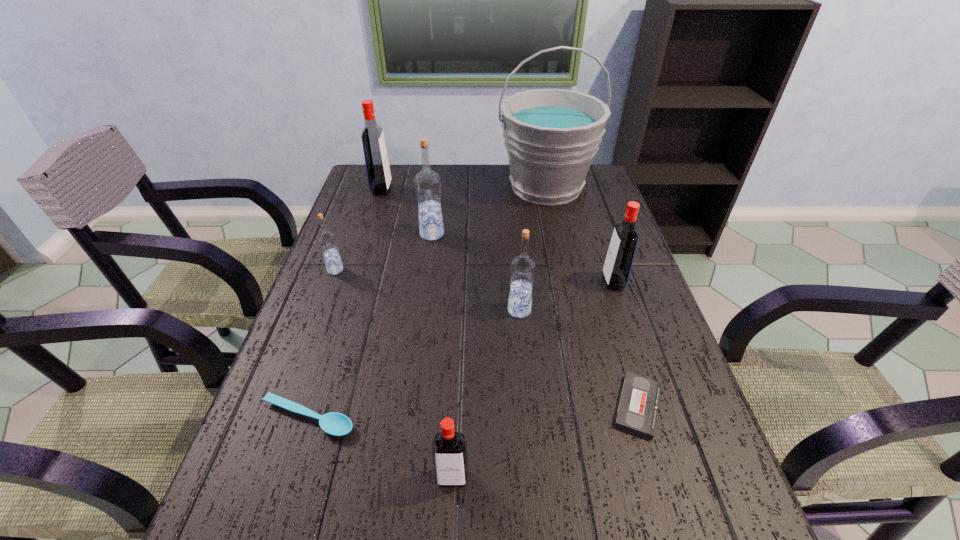
Locate an element on the screen. The image size is (960, 540). bucket present at the right edge is located at coordinates (551, 136).

Locate an element on the screen. The image size is (960, 540). vodka present at the right edge is located at coordinates (620, 255).

At what (x,y) coordinates should I click in order to perform the action: click on videotape that is at the right edge. Please return your answer as a coordinate pair (x, y). Image resolution: width=960 pixels, height=540 pixels. Looking at the image, I should click on (637, 412).

You are a GUI agent. You are given a task and a screenshot of the screen. Output one action in this format:
    pyautogui.click(x=<x>, y=<y>)
    Task: Click on the object that is at the far left corner
    This screenshot has height=540, width=960.
    Given the screenshot: What is the action you would take?
    pyautogui.click(x=376, y=160)

What are the coordinates of `object that is at the far right corner` in the screenshot? It's located at coord(551,136).

This screenshot has width=960, height=540. In the image, there is a desktop. In order to click on free space at the far edge in this screenshot , I will do `click(505, 176)`.

In the image, there is a desktop. Where is `vacant space at the left edge`? This screenshot has width=960, height=540. vacant space at the left edge is located at coordinates (360, 301).

Image resolution: width=960 pixels, height=540 pixels. In the image, there is a desktop. Find the location of `vacant space at the right edge`. vacant space at the right edge is located at coordinates (708, 478).

Identify the location of empty space that is in between the rightmost blue vodka and the smallest red vodka. (486, 394).

Identify the location of vacant region between the shortest object and the rightmost blue vodka. (579, 358).